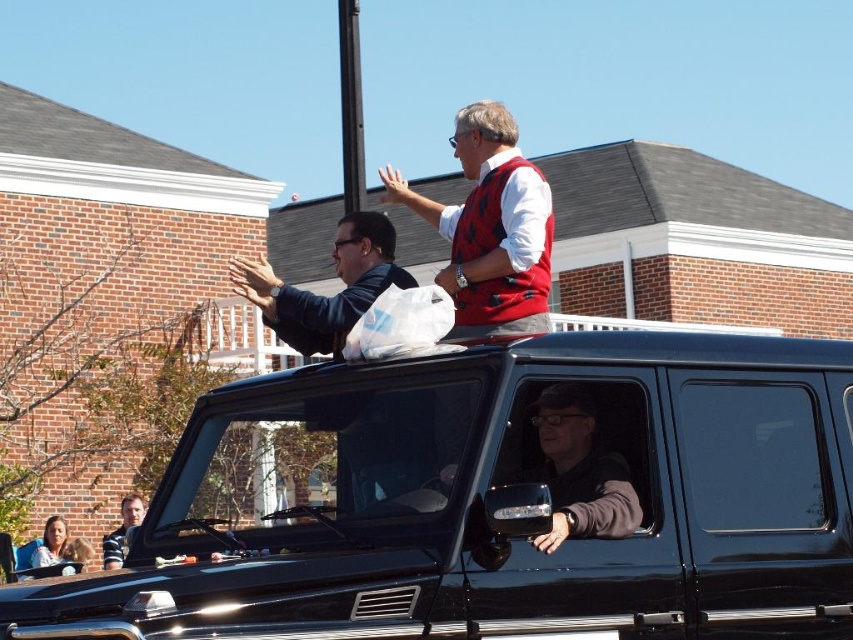
Who is taller, matte red vest at upper center or matte black jacket at center?

With more height is matte red vest at upper center.

Can you confirm if matte red vest at upper center is positioned below matte black jacket at center?

No.

At what (x,y) coordinates should I click in order to perform the action: click on matte red vest at upper center. Please return your answer as a coordinate pair (x, y). Looking at the image, I should click on (490, 227).

I want to click on matte black jacket at center, so (x=579, y=472).

Is point (630, 529) less distant than point (387, 264)?

Yes, it is in front of point (387, 264).

Who is more distant from viewer, (537, 435) or (352, 292)?

Positioned behind is point (352, 292).

Identify the location of matte black jacket at center. This screenshot has width=853, height=640. (579, 472).

Is black matte jeep at center smaller than matte red vest at upper center?

Correct, black matte jeep at center occupies less space than matte red vest at upper center.

Which is behind, point (688, 349) or point (500, 154)?

Positioned behind is point (500, 154).

Image resolution: width=853 pixels, height=640 pixels. What are the coordinates of `black matte jeep at center` in the screenshot? It's located at (494, 500).